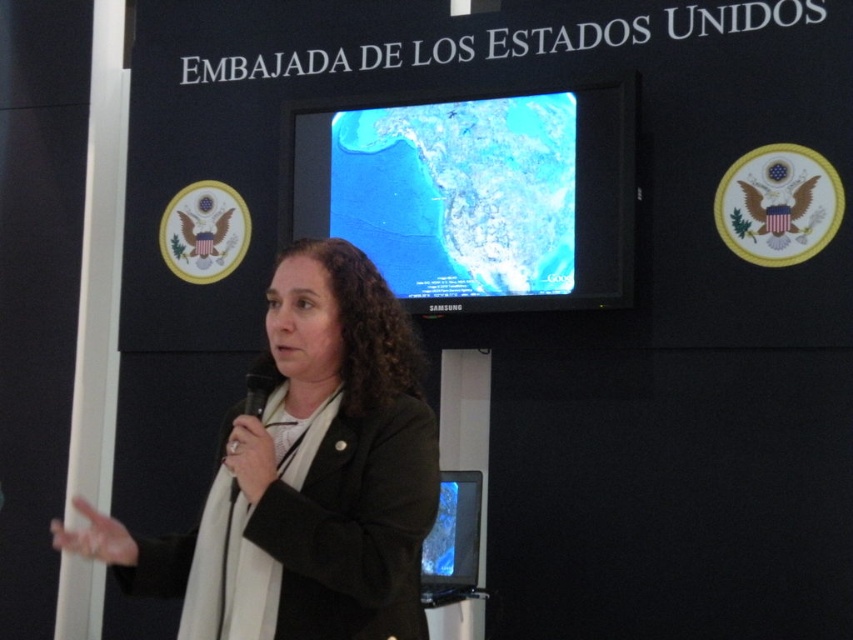
Question: Which point appears farthest from the camera in this image?

Choices:
 (A) (599, 284)
 (B) (347, 401)
 (C) (450, 536)

Answer: (A)

Question: Does black matte blazer at center come in front of matte blue screen at center?

Choices:
 (A) yes
 (B) no

Answer: (A)

Question: Considering the relative positions of black matte blazer at center and matte blue screen at center in the image provided, where is black matte blazer at center located with respect to matte blue screen at center?

Choices:
 (A) below
 (B) above

Answer: (B)

Question: Can you confirm if black matte blazer at center is wider than matte blue screen at center?

Choices:
 (A) no
 (B) yes

Answer: (B)

Question: Which of these objects is positioned farthest from the matte blue screen at center?

Choices:
 (A) black matte blazer at center
 (B) matte black screen at center

Answer: (A)

Question: Which point is farther from the camera taking this photo?

Choices:
 (A) (393, 160)
 (B) (254, 484)

Answer: (A)